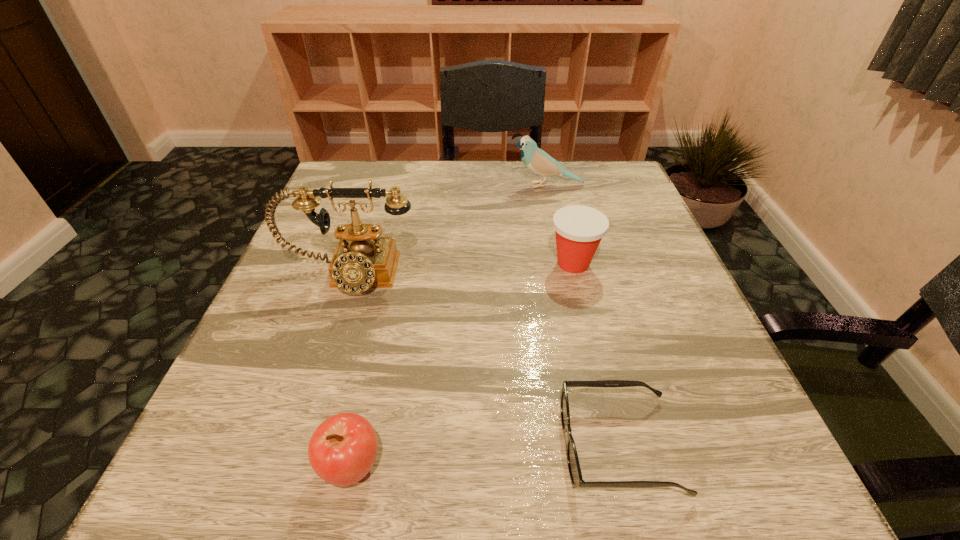
Select which object is the second closest to the farthest object. Please provide its 2D coordinates. Your answer should be formatted as a tuple, i.e. [(x, y)], where the tuple contains the x and y coordinates of a point satisfying the conditions above.

[(362, 259)]

The width and height of the screenshot is (960, 540). What are the coordinates of `free space in the image that satisfies the following two spatial constraints: 1. at the front lenses of the shortest object; 2. on the front side of the apple` in the screenshot? It's located at (625, 467).

You are a GUI agent. You are given a task and a screenshot of the screen. Output one action in this format:
    pyautogui.click(x=<x>, y=<y>)
    Task: Click on the vacant space that satisfies the following two spatial constraints: 1. on the back side of the Dixie cup; 2. on the right side of the apple
    The height and width of the screenshot is (540, 960).
    Given the screenshot: What is the action you would take?
    pyautogui.click(x=396, y=264)